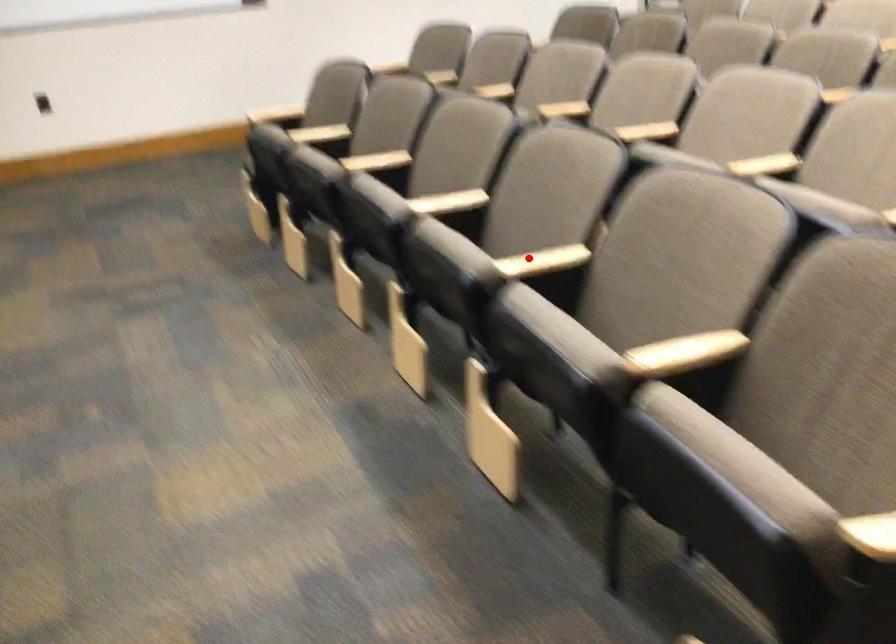
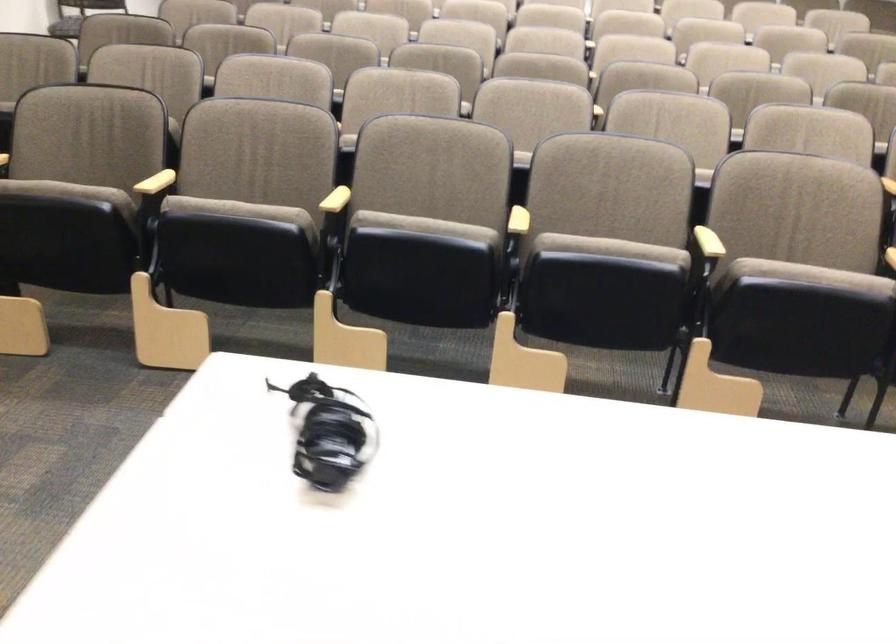
Where in the second image is the point corresponding to the highlighted location from the first image?

(709, 242)